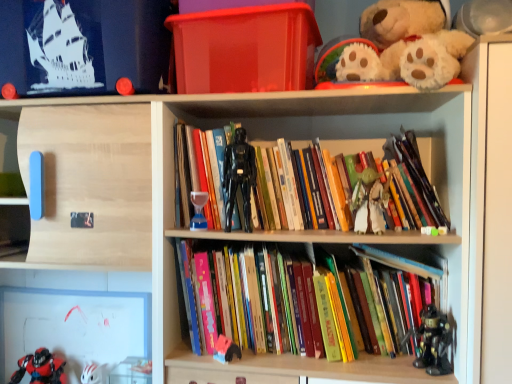
What do you see at coordinates (198, 210) in the screenshot? The image size is (512, 384). I see `translucent glass hourglass at center, placed as the 5th toy when sorted from right to left` at bounding box center [198, 210].

In order to face plush pink and blue toy at center, the fifth toy from the top, should I rotate leftwards or rightwards?

It's best to rotate left around 4.044 degrees.

Image resolution: width=512 pixels, height=384 pixels. I want to click on plush pink and blue toy at center, the third toy when ordered from bottom to top, so click(225, 349).

Image resolution: width=512 pixels, height=384 pixels. I want to click on transparent plastic box at upper center, so click(x=245, y=49).

This screenshot has height=384, width=512. In order to click on white matte helmet at lower left, the sixth toy when ordered from right to left in this screenshot , I will do `click(93, 373)`.

This screenshot has height=384, width=512. What do you see at coordinates (93, 373) in the screenshot?
I see `white matte helmet at lower left, which ranks as the 2th toy in bottom-to-top order` at bounding box center [93, 373].

Find the location of a particular element. translucent glass hourglass at center, placed as the 3th toy when sorted from top to bottom is located at coordinates (198, 210).

Is metallic black robot at lower right, marked as the fourth toy in a bottom-to-top arrangement, facing towards green fabric yoda at center, acting as the 2th toy starting from the top?

No, metallic black robot at lower right, marked as the fourth toy in a bottom-to-top arrangement, does not turn towards green fabric yoda at center, acting as the 2th toy starting from the top.

Considering the sizes of objects metallic black robot at lower right, marked as the fourth toy in a bottom-to-top arrangement, and green fabric yoda at center, the 2th toy from the right, in the image provided, who is thinner, metallic black robot at lower right, marked as the fourth toy in a bottom-to-top arrangement, or green fabric yoda at center, the 2th toy from the right,?

green fabric yoda at center, the 2th toy from the right.

Starting from the metallic black robot at lower right, the 1th toy from the right, which toy is the 1st one to the left? Please provide its 2D coordinates.

[(368, 203)]

From the image's perspective, is metallic black robot at lower right, the 1th toy from the right, above or below green fabric yoda at center, arranged as the 6th toy when ordered from the bottom?

From the image's perspective, metallic black robot at lower right, the 1th toy from the right, appears below green fabric yoda at center, arranged as the 6th toy when ordered from the bottom.

Considering the sizes of objects white matte helmet at lower left, the 2th toy in the left-to-right sequence, and hardcover books at center, the first book in the top-to-bottom sequence, in the image provided, who is taller, white matte helmet at lower left, the 2th toy in the left-to-right sequence, or hardcover books at center, the first book in the top-to-bottom sequence,?

With more height is hardcover books at center, the first book in the top-to-bottom sequence.

Is white matte helmet at lower left, the sixth toy from the top, spatially inside hardcover books at center, the first book in the top-to-bottom sequence, or outside of it?

white matte helmet at lower left, the sixth toy from the top, is not inside hardcover books at center, the first book in the top-to-bottom sequence, it's outside.

From the image's perspective, would you say white matte helmet at lower left, the sixth toy from the top, is shown under hardcover books at center, the second book positioned from the bottom?

Correct, white matte helmet at lower left, the sixth toy from the top, appears lower than hardcover books at center, the second book positioned from the bottom, in the image.

Is point (104, 365) more distant than point (394, 173)?

Yes, point (104, 365) is behind point (394, 173).

Is point (243, 209) in front of point (360, 190)?

No, (243, 209) is further to viewer.

Which of these two, black plastic action figure at center, placed as the fifth toy when sorted from left to right, or green fabric yoda at center, the 2th toy from the right, stands taller?

black plastic action figure at center, placed as the fifth toy when sorted from left to right, is taller.

From a real-world perspective, is black plastic action figure at center, which is the seventh toy from bottom to top, on top of green fabric yoda at center, the 2th toy from the right?

Yes, from a real-world perspective, black plastic action figure at center, which is the seventh toy from bottom to top, is over green fabric yoda at center, the 2th toy from the right

Is black plastic action figure at center, placed as the fifth toy when sorted from left to right, looking in the opposite direction of green fabric yoda at center, acting as the 2th toy starting from the top?

black plastic action figure at center, placed as the fifth toy when sorted from left to right, does not have its back to green fabric yoda at center, acting as the 2th toy starting from the top.

Can you confirm if white plush toy at upper right is shorter than green fabric yoda at center, acting as the 2th toy starting from the top?

No.

Is white plush toy at upper right positioned in front of green fabric yoda at center, arranged as the 6th toy when ordered from the bottom?

Yes, it is.

Is green fabric yoda at center, arranged as the 6th toy when ordered from the bottom, a part of white plush toy at upper right?

No, white plush toy at upper right does not contain green fabric yoda at center, arranged as the 6th toy when ordered from the bottom.

Does point (387, 68) appear closer or farther from the camera than point (375, 204)?

Clearly, point (387, 68) is closer to the camera than point (375, 204).

Does white matte helmet at lower left, the 2th toy in the left-to-right sequence, turn towards plush pink and blue toy at center, which is the 4th toy from right to left?

No, white matte helmet at lower left, the 2th toy in the left-to-right sequence, is not facing towards plush pink and blue toy at center, which is the 4th toy from right to left.

The width and height of the screenshot is (512, 384). What are the coordinates of `toy that is the 3rd one when counting forward from the white matte helmet at lower left, the sixth toy from the top` in the screenshot? It's located at (225, 349).

Consider the image. From a real-world perspective, which object stands above the other?

plush pink and blue toy at center, the fifth toy from the top, from a real-world perspective.

In terms of height, does white matte helmet at lower left, which ranks as the 2th toy in bottom-to-top order, look taller or shorter compared to plush pink and blue toy at center, which is the 4th toy from right to left?

In the image, white matte helmet at lower left, which ranks as the 2th toy in bottom-to-top order, appears to be taller than plush pink and blue toy at center, which is the 4th toy from right to left.

Consider the image. Is hardcover books at center, arranged as the 1th book when ordered from the bottom, positioned far away from shiny red plastic toy at lower left, which appears as the 1th toy when viewed from the left?

Actually, hardcover books at center, arranged as the 1th book when ordered from the bottom, and shiny red plastic toy at lower left, which appears as the 1th toy when viewed from the left, are a little close together.

Is hardcover books at center, the 2th book viewed from the top, positioned beyond the bounds of shiny red plastic toy at lower left, which appears as the 1th toy when viewed from the left?

That's correct, hardcover books at center, the 2th book viewed from the top, is outside of shiny red plastic toy at lower left, which appears as the 1th toy when viewed from the left.

Based on their sizes in the image, would you say hardcover books at center, arranged as the 1th book when ordered from the bottom, is bigger or smaller than shiny red plastic toy at lower left, which is counted as the seventh toy, starting from the top?

In the image, hardcover books at center, arranged as the 1th book when ordered from the bottom, appears to be larger than shiny red plastic toy at lower left, which is counted as the seventh toy, starting from the top.

Does point (313, 321) come farther from viewer compared to point (39, 382)?

No, it is not.

From a real-world perspective, which object stands above the other?

hardcover books at center, the second book positioned from the bottom, from a real-world perspective.

Which is closer to the camera, (285, 152) or (433, 365)?

The point (433, 365) is closer to the camera.

Can you see hardcover books at center, the first book in the top-to-bottom sequence, touching metallic black robot at lower right, arranged as the 4th toy when viewed from the top?

No, hardcover books at center, the first book in the top-to-bottom sequence, is not in contact with metallic black robot at lower right, arranged as the 4th toy when viewed from the top.

How distant is hardcover books at center, the first book in the top-to-bottom sequence, from metallic black robot at lower right, marked as the fourth toy in a bottom-to-top arrangement?

They are 17.41 inches apart.

The image size is (512, 384). I want to click on toy that is the 1st object to the left of the metallic black robot at lower right, the 1th toy from the right, starting at the anchor, so pyautogui.click(x=368, y=203).

Which book is the 1st one when counting from the front of the white matte helmet at lower left, which ranks as the 2th toy in bottom-to-top order? Please provide its 2D coordinates.

[(337, 191)]

Looking at the image, which one is located closer to shiny red plastic toy at lower left, the first toy in the bottom-to-top sequence, white plush toy at upper right or black plastic action figure at center, the 1th toy when ordered from top to bottom?

black plastic action figure at center, the 1th toy when ordered from top to bottom, is positioned closer to the anchor shiny red plastic toy at lower left, the first toy in the bottom-to-top sequence.

Considering their positions, is wooden books at center positioned further to hardcover books at center, the first book in the top-to-bottom sequence, than hardcover books at center, the 2th book viewed from the top?

hardcover books at center, the 2th book viewed from the top.

When comparing their distances from hardcover books at center, the second book positioned from the bottom, does white matte helmet at lower left, the sixth toy from the top, or transparent plastic box at upper center seem further?

white matte helmet at lower left, the sixth toy from the top, lies further to hardcover books at center, the second book positioned from the bottom, than the other object.

From the image, which object appears to be nearer to translucent glass hourglass at center, acting as the third toy starting from the left, transparent plastic box at upper center or white plush toy at upper right?

transparent plastic box at upper center.

Considering their positions, is plush pink and blue toy at center, the third toy when ordered from bottom to top, positioned further to hardcover books at center, arranged as the 1th book when ordered from the bottom, than shiny red plastic toy at lower left, the first toy in the bottom-to-top sequence?

shiny red plastic toy at lower left, the first toy in the bottom-to-top sequence, is positioned further to the anchor hardcover books at center, arranged as the 1th book when ordered from the bottom.

From the picture: Which object lies nearer to the anchor point white plush toy at upper right, white matte helmet at lower left, the sixth toy from the top, or green fabric yoda at center, which is the sixth toy from left to right?

Among the two, green fabric yoda at center, which is the sixth toy from left to right, is located nearer to white plush toy at upper right.

In the scene shown: Looking at the image, which one is located closer to hardcover books at center, the second book positioned from the bottom, metallic black robot at lower right, the 1th toy from the right, or translucent glass hourglass at center, placed as the 5th toy when sorted from right to left?

Based on the image, translucent glass hourglass at center, placed as the 5th toy when sorted from right to left, appears to be nearer to hardcover books at center, the second book positioned from the bottom.

Looking at the image, which one is located further to white matte helmet at lower left, the sixth toy from the top, green fabric yoda at center, which is the sixth toy from left to right, or metallic black robot at lower right, the seventh toy viewed from the left?

Among the two, metallic black robot at lower right, the seventh toy viewed from the left, is located further to white matte helmet at lower left, the sixth toy from the top.

Find the location of a particular element. shelf between translucent glass hourglass at center, acting as the third toy starting from the left, and green fabric yoda at center, which is the sixth toy from left to right, from left to right is located at coordinates (173, 174).

This screenshot has height=384, width=512. I want to click on shelf that lies between white plush toy at upper right and plush pink and blue toy at center, which is the 4th toy from right to left, from top to bottom, so click(x=173, y=174).

The width and height of the screenshot is (512, 384). Identify the location of shelf located between shiny red plastic toy at lower left, which is the seventh toy from right to left, and metallic black robot at lower right, the seventh toy viewed from the left, in the left-right direction. (173, 174).

In order to click on book between translucent glass hourglass at center, placed as the 5th toy when sorted from right to left, and plush pink and blue toy at center, which appears as the fourth toy when viewed from the left, vertically in this screenshot , I will do `click(281, 304)`.